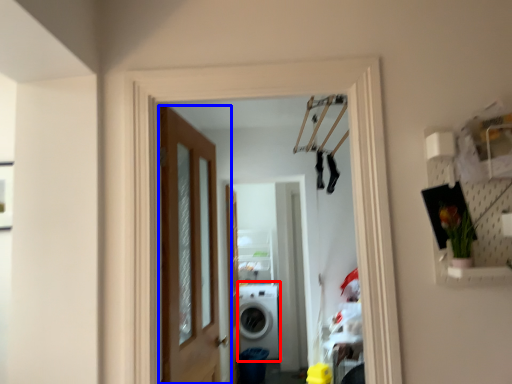
Question: Among these objects, which one is farthest to the camera, washing machine (highlighted by a red box) or door (highlighted by a blue box)?

Choices:
 (A) washing machine
 (B) door

Answer: (A)